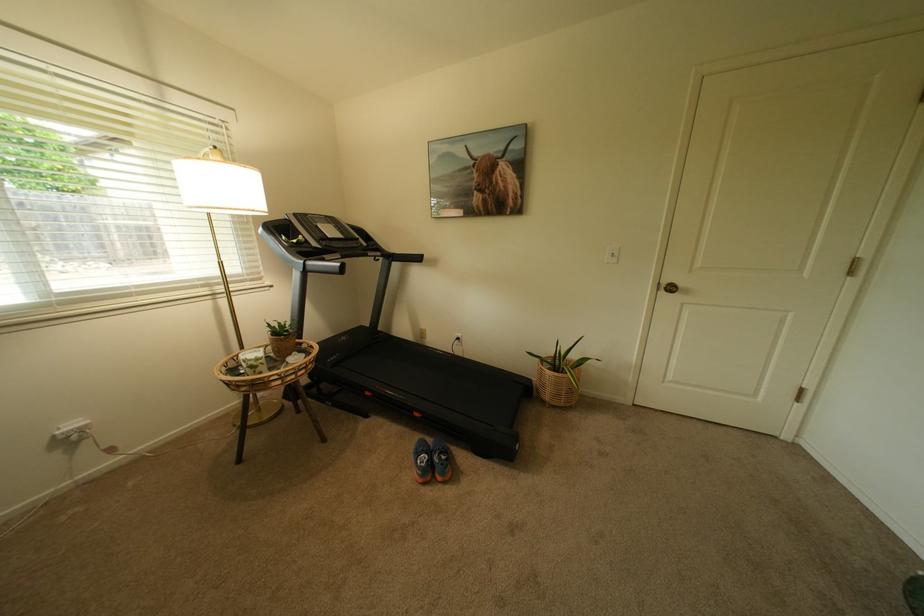
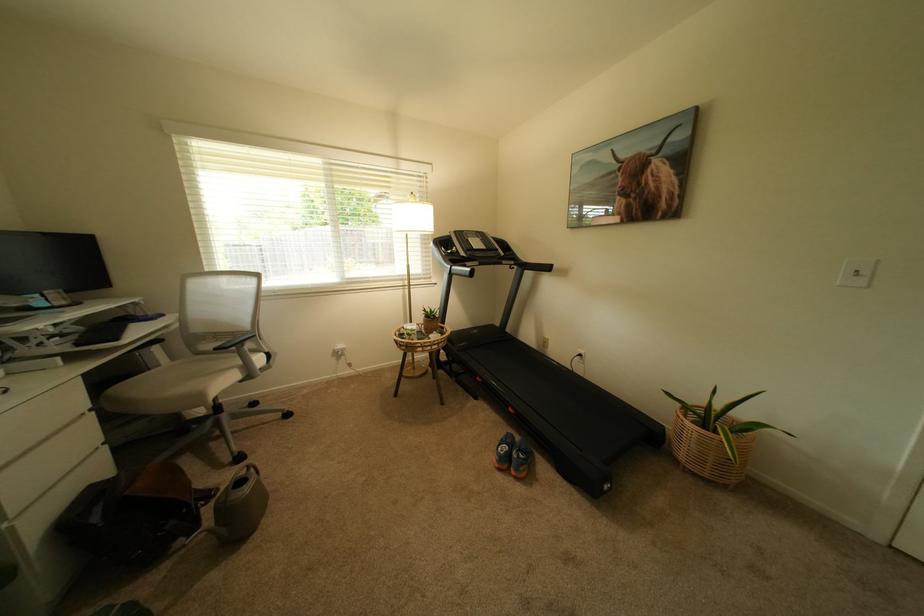
Where in the second image is the point corresponding to point (350, 238) from the first image?

(493, 249)